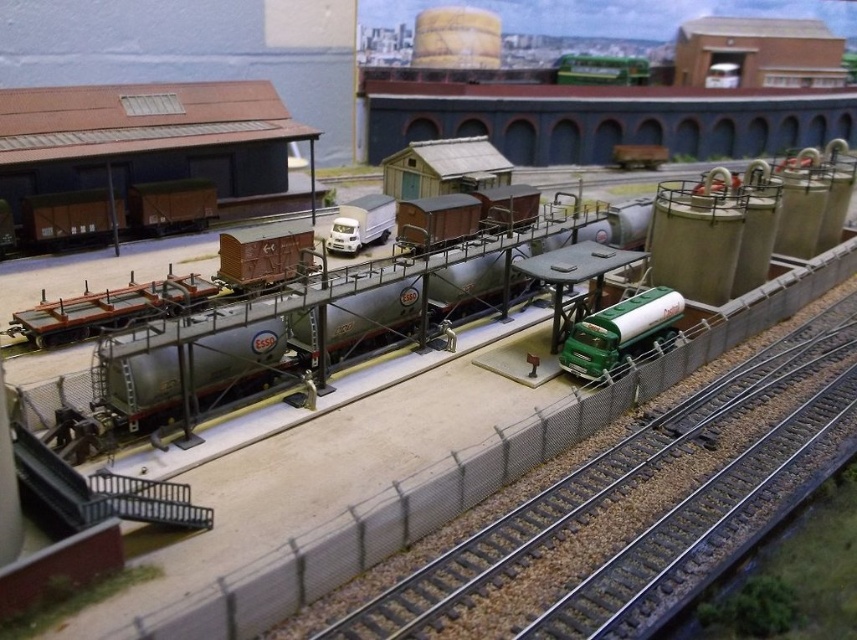
Question: Based on their relative distances, which object is nearer to the metallic silver tank car at center?

Choices:
 (A) green matte tanker truck at center-right
 (B) metallic gray train track at center

Answer: (A)

Question: Can you confirm if metallic silver tank car at center is wider than green matte tanker truck at center-right?

Choices:
 (A) no
 (B) yes

Answer: (B)

Question: Is the position of metallic gray train track at center more distant than that of green matte tanker truck at center-right?

Choices:
 (A) no
 (B) yes

Answer: (A)

Question: Which of the following is the farthest from the observer?

Choices:
 (A) (436, 273)
 (B) (586, 316)

Answer: (A)

Question: Where is metallic gray train track at center located in relation to metallic silver tank car at center in the image?

Choices:
 (A) below
 (B) above

Answer: (A)

Question: Which point is farther to the camera?

Choices:
 (A) metallic gray train track at center
 (B) green matte tanker truck at center-right
 (C) metallic silver tank car at center

Answer: (B)